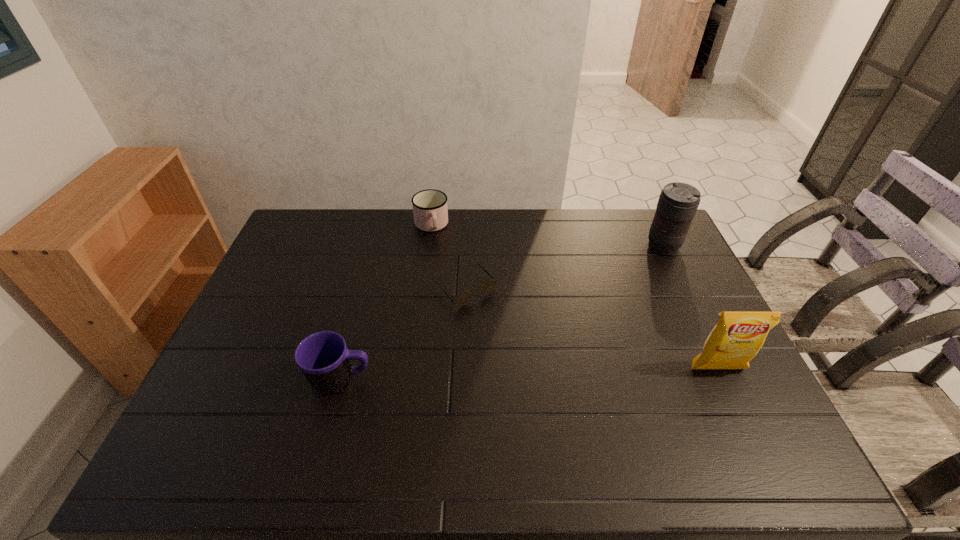
This screenshot has width=960, height=540. I want to click on unoccupied position between the shortest object and the shorter mug, so point(448,257).

Find the location of `the fourth closest object to the crisp (potato chip)`. the fourth closest object to the crisp (potato chip) is located at coordinates (430, 210).

The image size is (960, 540). I want to click on object that is the closest one to the right mug, so click(x=487, y=286).

Image resolution: width=960 pixels, height=540 pixels. Find the location of `free space that satisfies the following two spatial constraints: 1. on the back side of the third nearest object; 2. on the right side of the telephoto lens`. free space that satisfies the following two spatial constraints: 1. on the back side of the third nearest object; 2. on the right side of the telephoto lens is located at coordinates (468, 246).

Where is `free location that satisfies the following two spatial constraints: 1. on the front side of the shorter mug; 2. on the left side of the third nearest object`? Image resolution: width=960 pixels, height=540 pixels. free location that satisfies the following two spatial constraints: 1. on the front side of the shorter mug; 2. on the left side of the third nearest object is located at coordinates (422, 288).